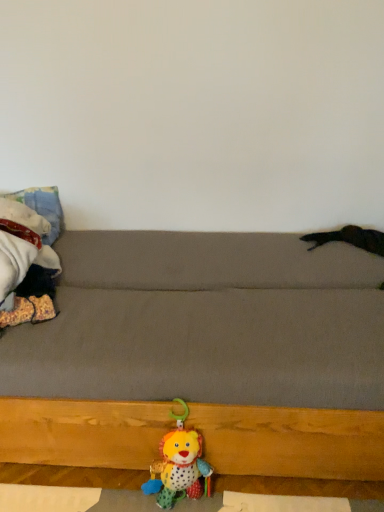
Describe the element at coordinates (206, 353) in the screenshot. I see `gray fabric couch at center` at that location.

This screenshot has height=512, width=384. I want to click on fluffy fabric blanket at left, the 1th toy when ordered from top to bottom, so click(27, 265).

This screenshot has width=384, height=512. In order to click on studio couch in front of the fluffy fabric blanket at left, marked as the 1th toy in a left-to-right arrangement in this screenshot , I will do `click(206, 353)`.

Does fluffy fabric blanket at left, which is the 2th toy in right-to-left order, appear on the left side of gray fabric couch at center?

Indeed, fluffy fabric blanket at left, which is the 2th toy in right-to-left order, is positioned on the left side of gray fabric couch at center.

Is point (11, 252) closer or farther from the camera than point (299, 468)?

Point (11, 252) is farther from the camera than point (299, 468).

Is fluffy fabric blanket at left, marked as the 1th toy in a left-to-right arrangement, facing away from gray fabric couch at center?

No, fluffy fabric blanket at left, marked as the 1th toy in a left-to-right arrangement, is not facing away from gray fabric couch at center.

Based on the photo, is gray fabric couch at center far from fluffy fabric blanket at left, marked as the 1th toy in a left-to-right arrangement?

They are positioned close to each other.

From the image's perspective, is gray fabric couch at center located above or below fluffy fabric blanket at left, marked as the 1th toy in a left-to-right arrangement?

Based on their image positions, gray fabric couch at center is located beneath fluffy fabric blanket at left, marked as the 1th toy in a left-to-right arrangement.

What's the angular difference between gray fabric couch at center and fluffy fabric blanket at left, the 1th toy when ordered from top to bottom,'s facing directions?

The facing directions of gray fabric couch at center and fluffy fabric blanket at left, the 1th toy when ordered from top to bottom, are 0.953 degrees apart.

In terms of height, does gray fabric couch at center look taller or shorter compared to fluffy fabric blanket at left, marked as the 1th toy in a left-to-right arrangement?

Considering their sizes, gray fabric couch at center has more height than fluffy fabric blanket at left, marked as the 1th toy in a left-to-right arrangement.

Is fluffy fabric blanket at left, which is the 2th toy in bottom-to-top order, looking in the opposite direction of soft plush lion at lower center, which is the 1th toy in right-to-left order?

No, fluffy fabric blanket at left, which is the 2th toy in bottom-to-top order, is not facing away from soft plush lion at lower center, which is the 1th toy in right-to-left order.

Between fluffy fabric blanket at left, which is the 2th toy in right-to-left order, and soft plush lion at lower center, which ranks as the first toy in bottom-to-top order, which one has smaller width?

soft plush lion at lower center, which ranks as the first toy in bottom-to-top order, is thinner.

Measure the distance from fluffy fabric blanket at left, which is the 2th toy in right-to-left order, to soft plush lion at lower center, which ranks as the first toy in bottom-to-top order.

24.48 inches.

Are fluffy fabric blanket at left, marked as the 1th toy in a left-to-right arrangement, and soft plush lion at lower center, which is counted as the 2th toy, starting from the left, beside each other?

No, fluffy fabric blanket at left, marked as the 1th toy in a left-to-right arrangement, is not touching soft plush lion at lower center, which is counted as the 2th toy, starting from the left.

Between soft plush lion at lower center, which ranks as the second toy in top-to-bottom order, and gray fabric couch at center, which one appears on the right side from the viewer's perspective?

soft plush lion at lower center, which ranks as the second toy in top-to-bottom order, is more to the right.

Looking at their sizes, would you say soft plush lion at lower center, which is counted as the 2th toy, starting from the left, is wider or thinner than gray fabric couch at center?

Considering their sizes, soft plush lion at lower center, which is counted as the 2th toy, starting from the left, looks slimmer than gray fabric couch at center.

Is soft plush lion at lower center, which ranks as the second toy in top-to-bottom order, next to gray fabric couch at center?

No, soft plush lion at lower center, which ranks as the second toy in top-to-bottom order, is not making contact with gray fabric couch at center.

Based on their sizes in the image, would you say soft plush lion at lower center, which ranks as the first toy in bottom-to-top order, is bigger or smaller than gray fabric couch at center?

Clearly, soft plush lion at lower center, which ranks as the first toy in bottom-to-top order, is smaller in size than gray fabric couch at center.

Is gray fabric couch at center not within soft plush lion at lower center, which is counted as the 2th toy, starting from the left?

Yes, gray fabric couch at center is located beyond the bounds of soft plush lion at lower center, which is counted as the 2th toy, starting from the left.

At what (x,y) coordinates should I click in order to perform the action: click on studio couch on the left of soft plush lion at lower center, which is the 1th toy in right-to-left order. Please return your answer as a coordinate pair (x, y). This screenshot has width=384, height=512. Looking at the image, I should click on (206, 353).

Is gray fabric couch at center at the left side of soft plush lion at lower center, which ranks as the first toy in bottom-to-top order?

Yes, gray fabric couch at center is to the left of soft plush lion at lower center, which ranks as the first toy in bottom-to-top order.

From the image's perspective, would you say soft plush lion at lower center, which ranks as the second toy in top-to-bottom order, is shown under fluffy fabric blanket at left, which is the 2th toy in right-to-left order?

Yes.

Based on the photo, are soft plush lion at lower center, which is the 1th toy in right-to-left order, and fluffy fabric blanket at left, the 1th toy when ordered from top to bottom, located far from each other?

No, soft plush lion at lower center, which is the 1th toy in right-to-left order, is in close proximity to fluffy fabric blanket at left, the 1th toy when ordered from top to bottom.

You are a GUI agent. You are given a task and a screenshot of the screen. Output one action in this format:
    pyautogui.click(x=<x>, y=<y>)
    Task: Click on the toy below the fluffy fabric blanket at left, which is the 2th toy in right-to-left order (from a real-world perspective)
    
    Given the screenshot: What is the action you would take?
    pyautogui.click(x=179, y=465)

Is soft plush lion at lower center, which ranks as the first toy in bottom-to-top order, facing towards fluffy fabric blanket at left, which is the 2th toy in right-to-left order?

No.

This screenshot has width=384, height=512. I want to click on the 2nd toy behind when counting from the gray fabric couch at center, so click(27, 265).

Where is `toy above the gray fabric couch at center (from a real-world perspective)`? Image resolution: width=384 pixels, height=512 pixels. toy above the gray fabric couch at center (from a real-world perspective) is located at coordinates (27, 265).

When comparing their distances from fluffy fabric blanket at left, which is the 2th toy in right-to-left order, does soft plush lion at lower center, which is the 1th toy in right-to-left order, or gray fabric couch at center seem further?

Based on the image, soft plush lion at lower center, which is the 1th toy in right-to-left order, appears to be further to fluffy fabric blanket at left, which is the 2th toy in right-to-left order.

When comparing their distances from soft plush lion at lower center, which ranks as the first toy in bottom-to-top order, does fluffy fabric blanket at left, which is the 2th toy in bottom-to-top order, or gray fabric couch at center seem further?

fluffy fabric blanket at left, which is the 2th toy in bottom-to-top order, lies further to soft plush lion at lower center, which ranks as the first toy in bottom-to-top order, than the other object.

When comparing their distances from soft plush lion at lower center, which ranks as the second toy in top-to-bottom order, does gray fabric couch at center or fluffy fabric blanket at left, which is the 2th toy in right-to-left order, seem closer?

gray fabric couch at center is positioned closer to the anchor soft plush lion at lower center, which ranks as the second toy in top-to-bottom order.

Based on their spatial positions, is fluffy fabric blanket at left, the 1th toy when ordered from top to bottom, or soft plush lion at lower center, which ranks as the first toy in bottom-to-top order, further from gray fabric couch at center?

The object further to gray fabric couch at center is fluffy fabric blanket at left, the 1th toy when ordered from top to bottom.

When comparing their distances from fluffy fabric blanket at left, which is the 2th toy in bottom-to-top order, does gray fabric couch at center or soft plush lion at lower center, which ranks as the second toy in top-to-bottom order, seem closer?

The object closer to fluffy fabric blanket at left, which is the 2th toy in bottom-to-top order, is gray fabric couch at center.

Looking at the image, which one is located further to gray fabric couch at center, soft plush lion at lower center, which is counted as the 2th toy, starting from the left, or fluffy fabric blanket at left, which is the 2th toy in right-to-left order?

Among the two, fluffy fabric blanket at left, which is the 2th toy in right-to-left order, is located further to gray fabric couch at center.

At what (x,y) coordinates should I click in order to perform the action: click on studio couch between fluffy fabric blanket at left, the 1th toy when ordered from top to bottom, and soft plush lion at lower center, which ranks as the first toy in bottom-to-top order, from left to right. Please return your answer as a coordinate pair (x, y). The width and height of the screenshot is (384, 512). Looking at the image, I should click on (206, 353).